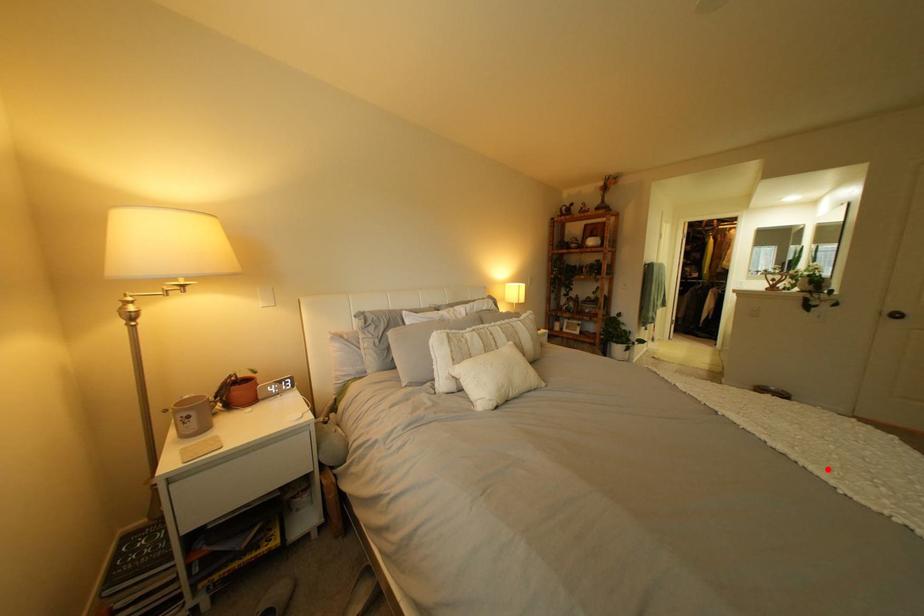
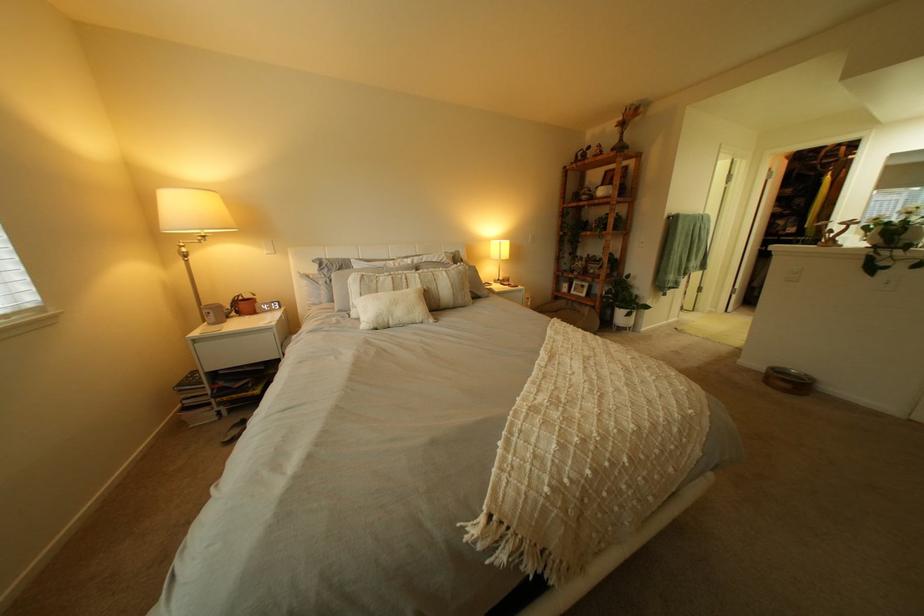
The point at the highlighted location is marked in the first image. Where is the corresponding point in the second image?

(541, 387)